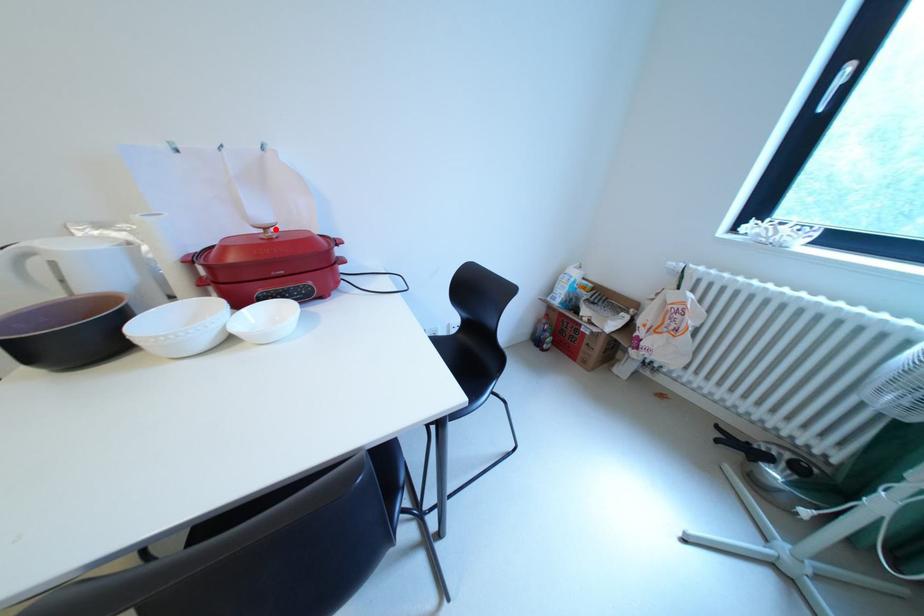
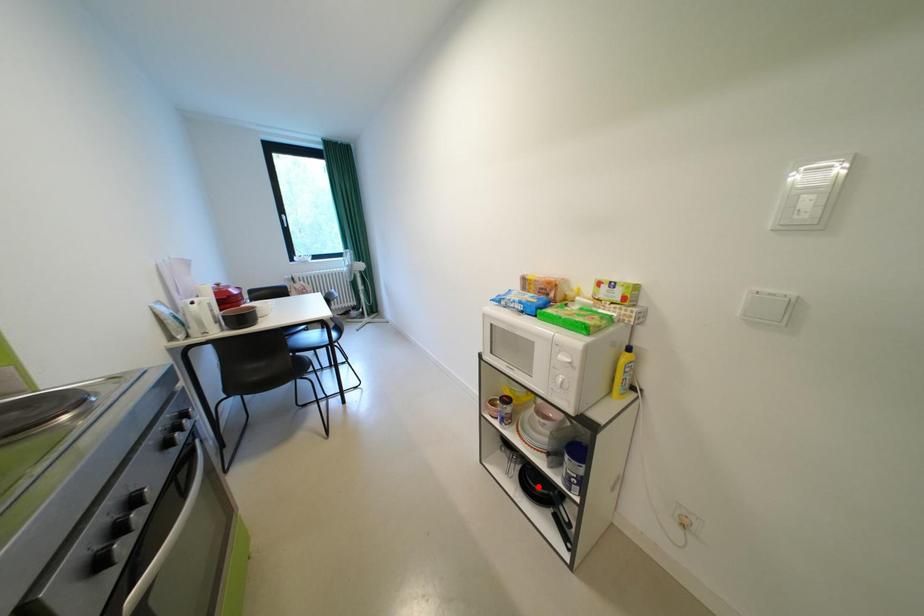
I am providing you with two images of the same scene from different viewpoints. A red point is marked on the first image and another point is marked on the second image. Does the point marked in image1 correspond to the same location as the one in image2?

No